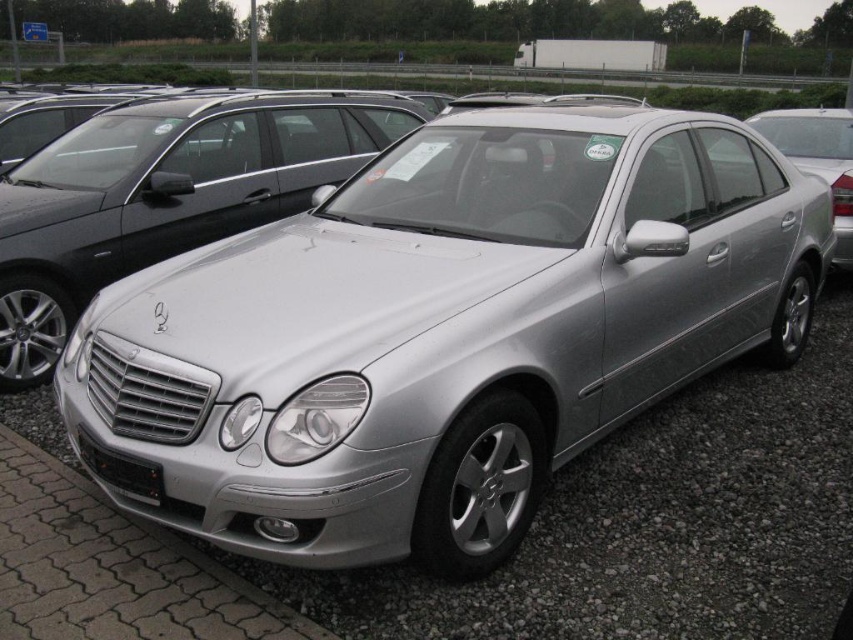
Question: Which object appears closest to the camera in this image?

Choices:
 (A) silver metallic car at center
 (B) black matte license plate at front
 (C) satin silver car at center
 (D) silver metallic sedan at center

Answer: (A)

Question: Where is satin silver car at center located in relation to black matte license plate at front in the image?

Choices:
 (A) below
 (B) above

Answer: (B)

Question: Based on their relative distances, which object is nearer to the satin silver car at center?

Choices:
 (A) black matte license plate at front
 (B) silver metallic sedan at center
 (C) silver metallic car at center

Answer: (C)

Question: Can you confirm if silver metallic car at center is bigger than black matte license plate at front?

Choices:
 (A) yes
 (B) no

Answer: (A)

Question: Does satin silver car at center appear on the left side of silver metallic sedan at center?

Choices:
 (A) no
 (B) yes

Answer: (B)

Question: Estimate the real-world distances between objects in this image. Which object is farther from the silver metallic sedan at center?

Choices:
 (A) silver metallic car at center
 (B) black matte license plate at front
 (C) satin silver car at center

Answer: (B)